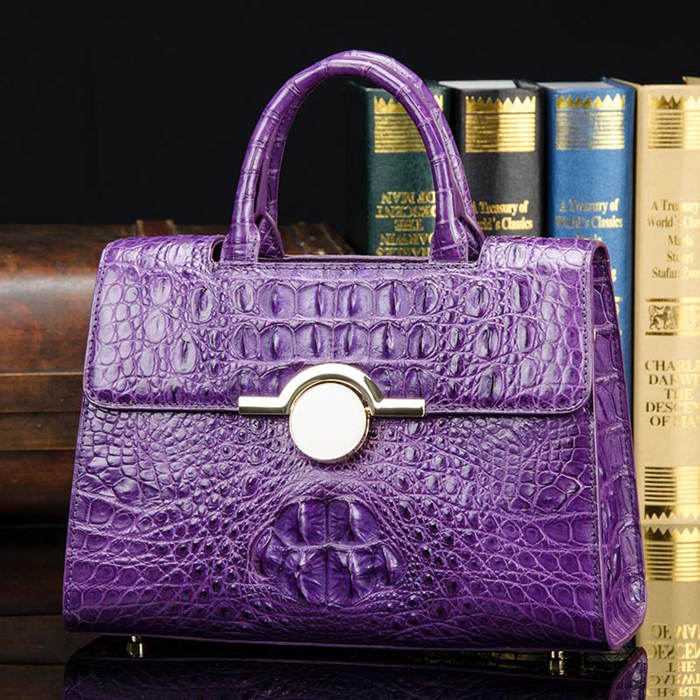
Locate an element on the screen. This screenshot has width=700, height=700. books is located at coordinates (666, 246), (580, 186), (523, 172), (393, 176).